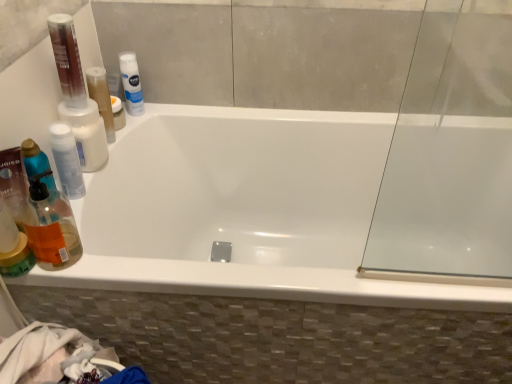
I want to click on vacant area that lies to the right of white matte nivea spray at upper center, which is the 3th mouthwash in front-to-back order, so click(x=181, y=108).